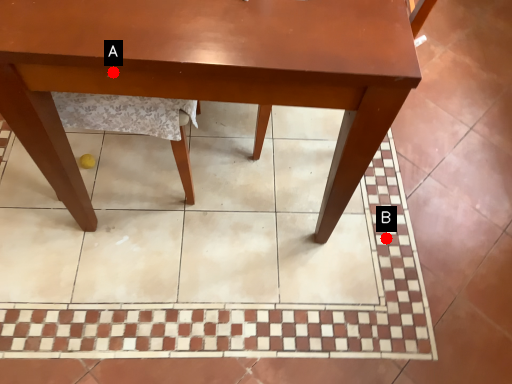
Question: Two points are circled on the image, labeled by A and B beside each circle. Which point is further to the camera?

Choices:
 (A) A is further
 (B) B is further

Answer: (B)